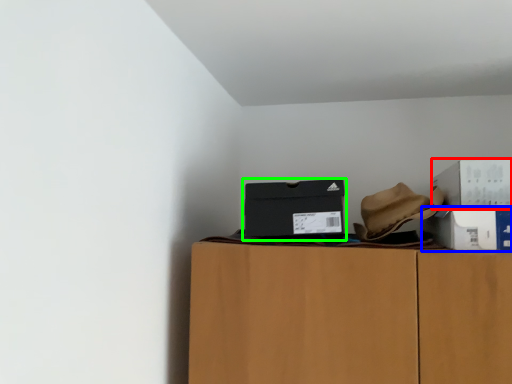
Question: Which object is the closest to the box (highlighted by a red box)? Choose among these: box (highlighted by a blue box) or box (highlighted by a green box).

Choices:
 (A) box
 (B) box

Answer: (A)